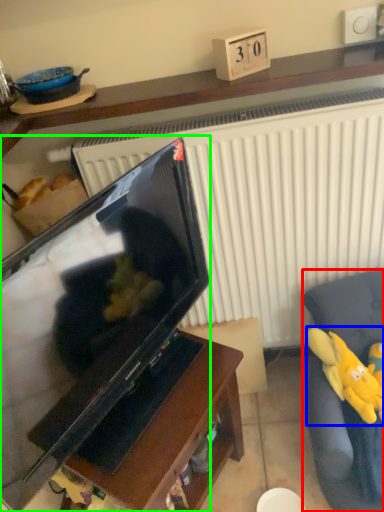
Question: Based on their relative distances, which object is nearer to furniture (highlighted by a red box)? Choose from toy (highlighted by a blue box) and television (highlighted by a green box).

Choices:
 (A) toy
 (B) television

Answer: (A)